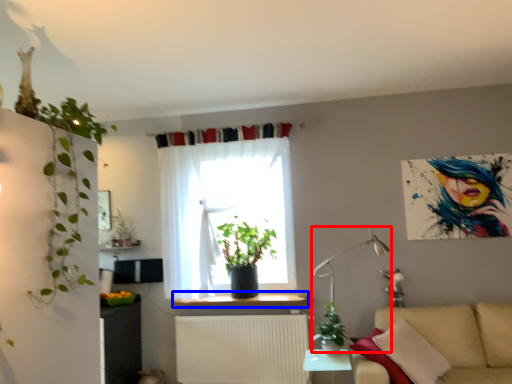
Question: Among these objects, which one is farthest to the camera, table lamp (highlighted by a red box) or window sill (highlighted by a blue box)?

Choices:
 (A) table lamp
 (B) window sill

Answer: (B)